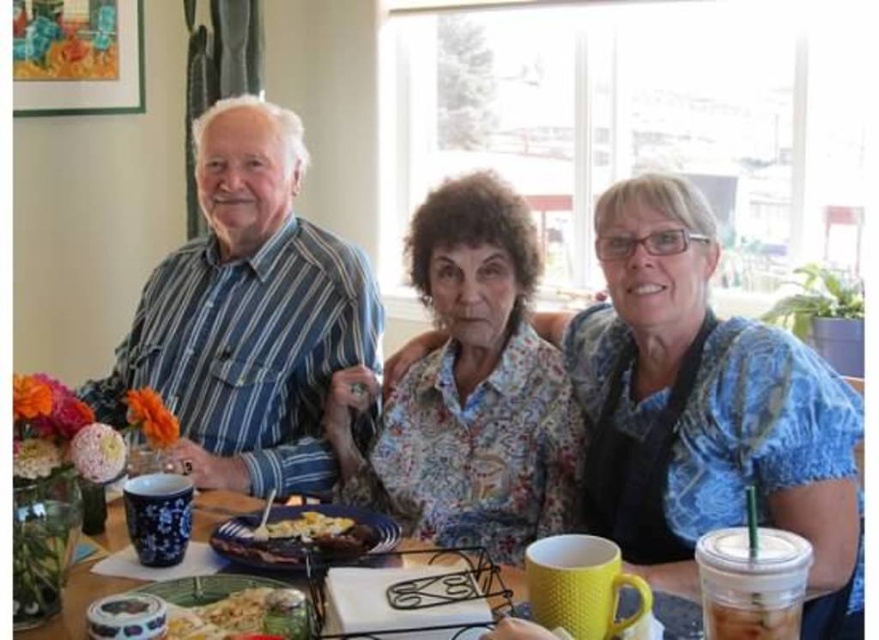
Question: Can you confirm if floral fabric blouse at center is thinner than clear plastic cup at lower right?

Choices:
 (A) no
 (B) yes

Answer: (A)

Question: Is striped cotton shirt at left above floral fabric blouse at center?

Choices:
 (A) yes
 (B) no

Answer: (A)

Question: Which point is farther to the camera?

Choices:
 (A) yellow matte mug at center
 (B) yellow fried egg at center
 (C) striped cotton shirt at left
 (D) floral fabric blouse at center

Answer: (C)

Question: Which point is farther from the camera taking this photo?

Choices:
 (A) (772, 588)
 (B) (292, 540)
 (C) (516, 474)
 (D) (120, 506)

Answer: (C)

Question: Is floral fabric blouse at center to the right of yellow matte mug at center from the viewer's perspective?

Choices:
 (A) yes
 (B) no

Answer: (A)

Question: Which point is closer to the camera?

Choices:
 (A) yellow matte mug at center
 (B) striped cotton shirt at left
 (C) golden crispy fried chicken at lower left

Answer: (C)